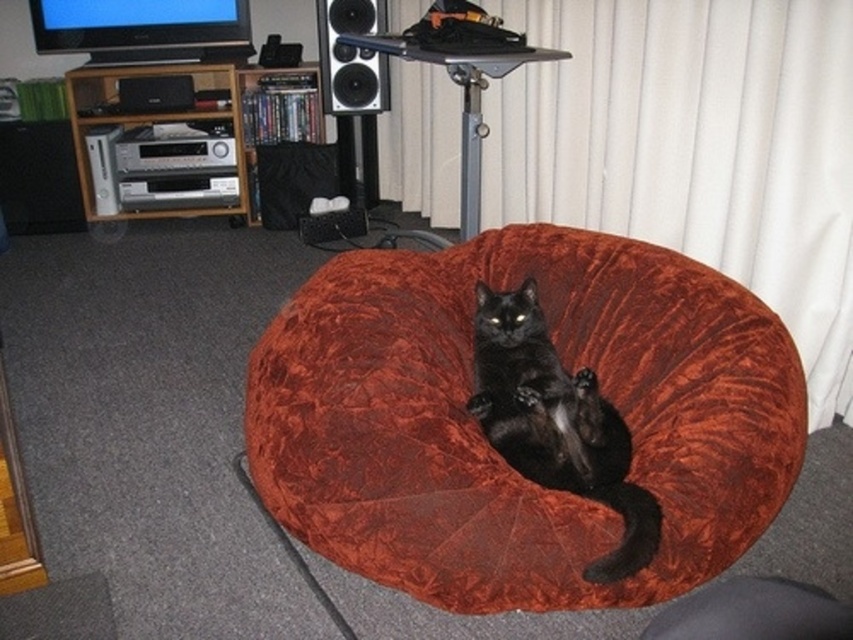
Question: Can you confirm if velvet orange bean bag chair at center is positioned above black fabric speaker at center?

Choices:
 (A) yes
 (B) no

Answer: (B)

Question: Which point is closer to the camera?

Choices:
 (A) (489, 310)
 (B) (733, 436)
 (C) (219, 83)

Answer: (B)

Question: Among these objects, which one is nearest to the camera?

Choices:
 (A) wooden entertainment center at left
 (B) black velvet cat at center
 (C) velvet orange bean bag chair at center
 (D) black fabric speaker at center

Answer: (B)

Question: Which object is farther from the camera taking this photo?

Choices:
 (A) wooden entertainment center at left
 (B) black fabric speaker at center

Answer: (A)

Question: Considering the relative positions of wooden entertainment center at left and black fabric speaker at center in the image provided, where is wooden entertainment center at left located with respect to black fabric speaker at center?

Choices:
 (A) left
 (B) right

Answer: (A)

Question: Is black velvet cat at center to the left of wooden entertainment center at left from the viewer's perspective?

Choices:
 (A) no
 (B) yes

Answer: (A)